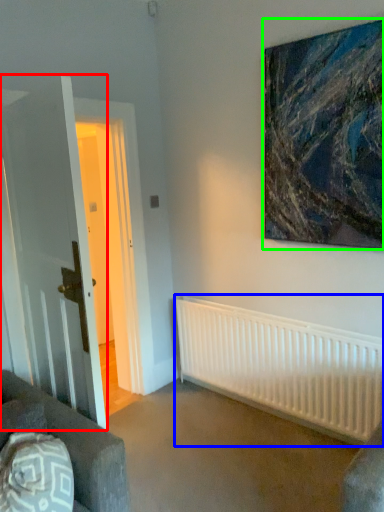
Question: Based on their relative distances, which object is nearer to glass door (highlighted by a red box)? Choose from radiator (highlighted by a blue box) and picture frame (highlighted by a green box).

Choices:
 (A) radiator
 (B) picture frame

Answer: (A)